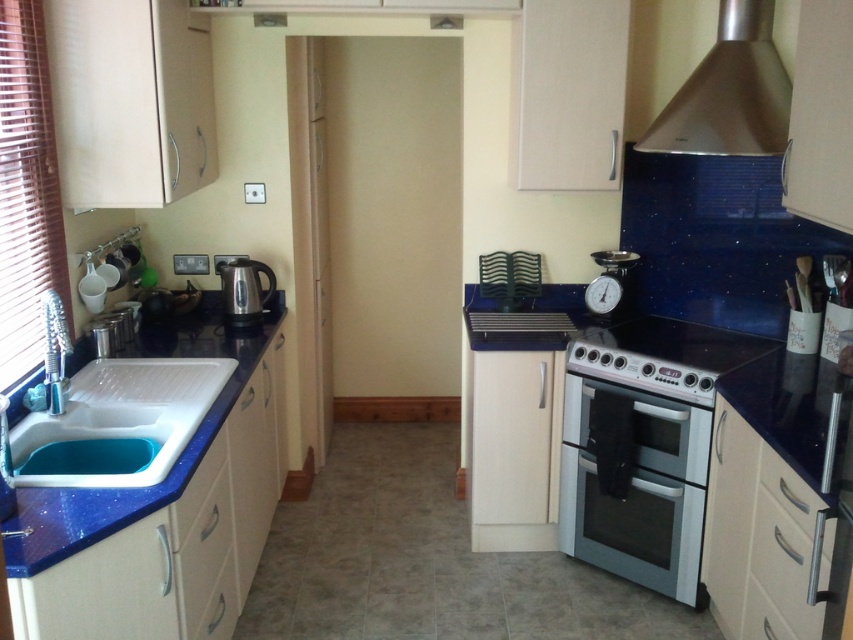
Question: Can you confirm if white glossy oven at center is positioned to the right of polished stainless steel kettle at left?

Choices:
 (A) yes
 (B) no

Answer: (A)

Question: Based on their relative distances, which object is nearer to the white glossy sink at left?

Choices:
 (A) polished stainless steel kettle at left
 (B) satin silver stove at center
 (C) white glossy oven at center

Answer: (A)

Question: Is blue granite sink at left above stainless steel exhaust hood at upper right?

Choices:
 (A) yes
 (B) no

Answer: (B)

Question: Does satin silver stove at center appear under metallic silver scale at right?

Choices:
 (A) yes
 (B) no

Answer: (A)

Question: Which point is farther from the camera taking this photo?

Choices:
 (A) (28, 486)
 (B) (61, 426)

Answer: (B)

Question: Which of the following is the farthest from the observer?

Choices:
 (A) white glossy sink at left
 (B) blue granite sink at left
 (C) satin silver stove at center

Answer: (C)